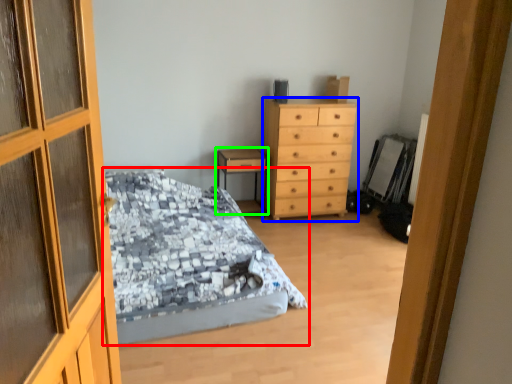
Question: Estimate the real-world distances between objects in this image. Which object is farther from bed (highlighted by a red box), chest of drawers (highlighted by a blue box) or nightstand (highlighted by a green box)?

Choices:
 (A) chest of drawers
 (B) nightstand

Answer: (B)